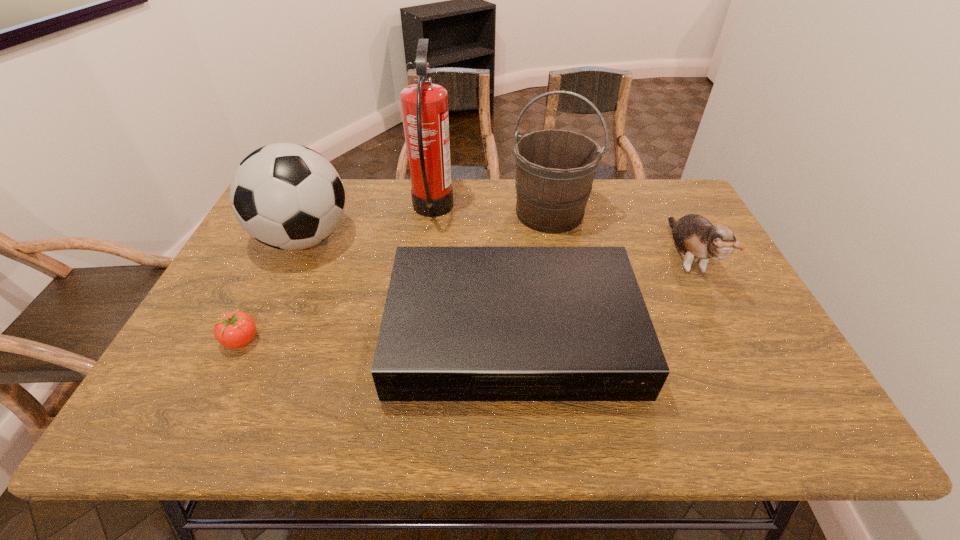
Locate an element on the screen. vacant area situated 0.320m at the face of the third shortest object is located at coordinates (767, 418).

I want to click on free region located at the front of the CD player for disc insertion, so pos(519,432).

The width and height of the screenshot is (960, 540). Find the location of `blank space located 0.150m on the front of the shortest object`. blank space located 0.150m on the front of the shortest object is located at coordinates (204, 416).

Find the location of a particular element. This screenshot has width=960, height=540. fire extinguisher present at the far edge is located at coordinates [x=424, y=105].

What are the coordinates of `bucket at the far edge` in the screenshot? It's located at (555, 169).

Locate an element on the screen. This screenshot has width=960, height=540. soccer ball present at the far edge is located at coordinates (287, 196).

Find the location of a particular element. This screenshot has width=960, height=540. object at the near edge is located at coordinates (460, 323).

Where is `soccer ball that is at the left edge`? The image size is (960, 540). soccer ball that is at the left edge is located at coordinates (287, 196).

Find the location of a particular element. The width and height of the screenshot is (960, 540). tomato positioned at the left edge is located at coordinates (236, 329).

I want to click on object that is at the right edge, so coord(696,238).